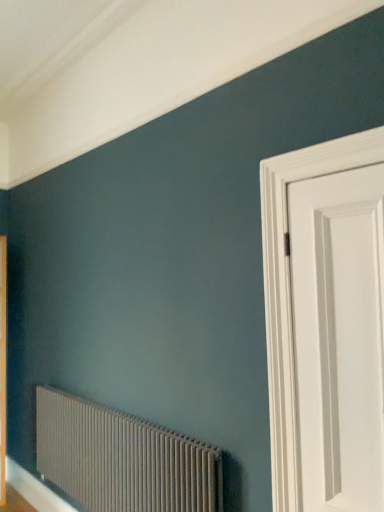
Question: Is white glossy door at right bigger or smaller than matte gray radiator at lower left?

Choices:
 (A) big
 (B) small

Answer: (B)

Question: Is white glossy door at right to the left or to the right of matte gray radiator at lower left in the image?

Choices:
 (A) right
 (B) left

Answer: (A)

Question: Is white glossy door at right inside or outside of matte gray radiator at lower left?

Choices:
 (A) inside
 (B) outside

Answer: (B)

Question: From a real-world perspective, is matte gray radiator at lower left above or below white glossy door at right?

Choices:
 (A) below
 (B) above

Answer: (A)

Question: In the image, is matte gray radiator at lower left on the left side or the right side of white glossy door at right?

Choices:
 (A) left
 (B) right

Answer: (A)

Question: Is matte gray radiator at lower left inside the boundaries of white glossy door at right, or outside?

Choices:
 (A) inside
 (B) outside

Answer: (B)

Question: In terms of width, does matte gray radiator at lower left look wider or thinner when compared to white glossy door at right?

Choices:
 (A) thin
 (B) wide

Answer: (B)